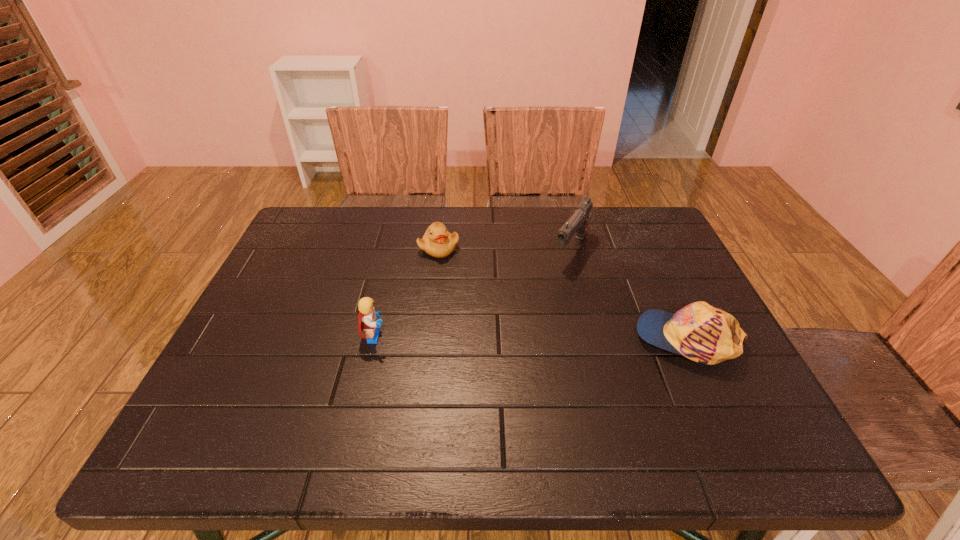
Identify the location of the leftmost object. The width and height of the screenshot is (960, 540). (367, 319).

At what (x,y) coordinates should I click in order to perform the action: click on cap. Please return your answer as a coordinate pair (x, y). Looking at the image, I should click on (705, 334).

Locate an element on the screen. The image size is (960, 540). gun is located at coordinates (578, 222).

Where is `duckling`? The width and height of the screenshot is (960, 540). duckling is located at coordinates (437, 241).

Where is `free spot located on the front-facing side of the leftmost object`? free spot located on the front-facing side of the leftmost object is located at coordinates (535, 336).

The image size is (960, 540). Find the location of `free region located on the bill of the rightmost object`. free region located on the bill of the rightmost object is located at coordinates (499, 339).

I want to click on vacant region located on the bill of the rightmost object, so click(611, 339).

This screenshot has height=540, width=960. What are the coordinates of `free space located 0.160m on the bill of the rightmost object` in the screenshot? It's located at (567, 339).

The height and width of the screenshot is (540, 960). I want to click on free region located 0.060m in the direction the second object from right to left is aimed, so click(x=556, y=280).

Find the location of a particular element. The height and width of the screenshot is (540, 960). vacant space located 0.300m in the direction the second object from right to left is aimed is located at coordinates (515, 339).